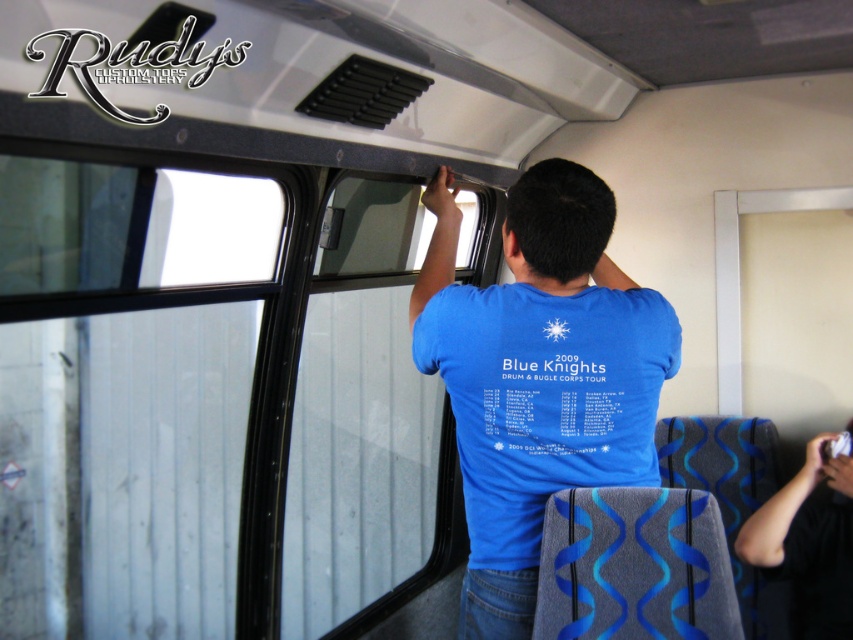
Can you confirm if blue matte shirt at upper center is shorter than blue fabric shirt at upper center?

No, blue matte shirt at upper center is not shorter than blue fabric shirt at upper center.

Is the position of blue matte shirt at upper center more distant than that of blue fabric shirt at upper center?

No.

Which is in front, point (648, 404) or point (752, 557)?

Positioned in front is point (648, 404).

In order to click on blue matte shirt at upper center in this screenshot , I will do `click(538, 376)`.